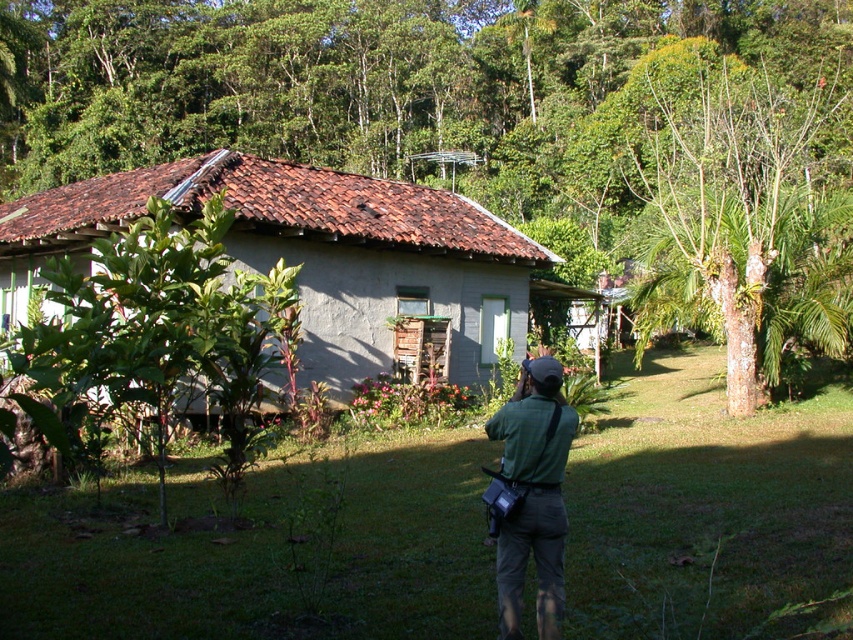
Question: In this image, where is brown wood tree at center located relative to gray stucco hut at center?

Choices:
 (A) right
 (B) left

Answer: (A)

Question: Which of the following is the farthest from the observer?

Choices:
 (A) (224, 108)
 (B) (636, 163)

Answer: (A)

Question: Is green leafy plant at center positioned behind green fabric camera bag at center?

Choices:
 (A) no
 (B) yes

Answer: (B)

Question: Which point is closer to the camera taking this photo?

Choices:
 (A) (279, 168)
 (B) (521, 403)

Answer: (B)

Question: Does brown wood tree at center come in front of green leafy plant at center?

Choices:
 (A) yes
 (B) no

Answer: (B)

Question: Which object is farther from the camera taking this photo?

Choices:
 (A) brown wood tree at center
 (B) smooth brown trunk at upper right

Answer: (A)